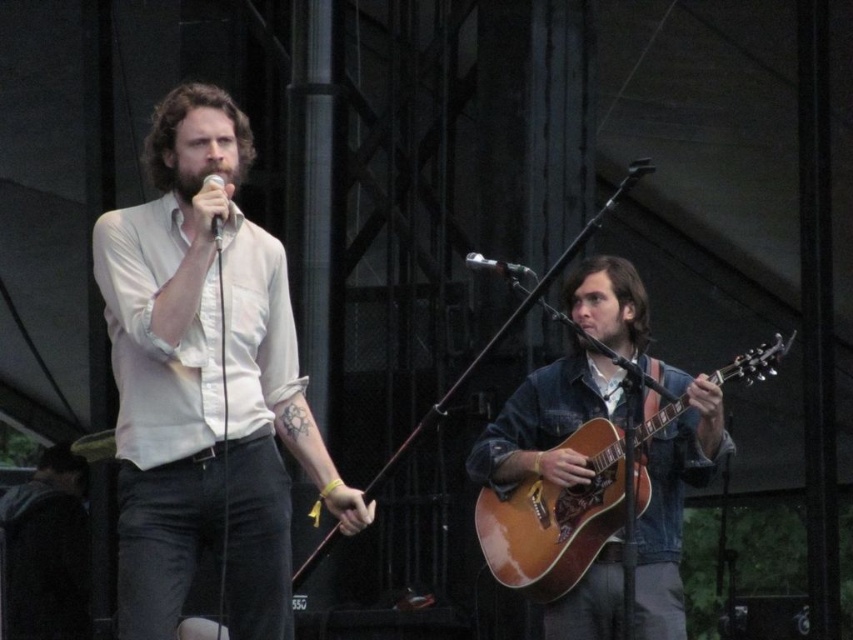
Question: Which of these objects is positioned farthest from the white cotton shirt at center?

Choices:
 (A) black leather jacket at lower left
 (B) matte black microphone at upper center

Answer: (A)

Question: Which point is farther to the camera?

Choices:
 (A) (662, 419)
 (B) (218, 234)
 (C) (485, 269)

Answer: (A)

Question: Is black leather jacket at lower left further to camera compared to metallic silver microphone at center?

Choices:
 (A) no
 (B) yes

Answer: (B)

Question: Does white cotton shirt at center have a lesser width compared to wooden acoustic guitar at right?

Choices:
 (A) no
 (B) yes

Answer: (B)

Question: Can you confirm if white cotton shirt at center is positioned below black leather jacket at lower left?

Choices:
 (A) yes
 (B) no

Answer: (B)

Question: Which of the following is the farthest from the observer?

Choices:
 (A) matte black microphone at upper center
 (B) wooden acoustic guitar at right

Answer: (B)